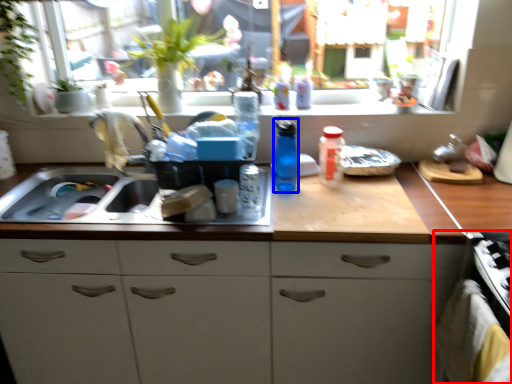
Question: Which of the following is the closest to the observer, oven (highlighted by a red box) or bottle (highlighted by a blue box)?

Choices:
 (A) oven
 (B) bottle

Answer: (A)